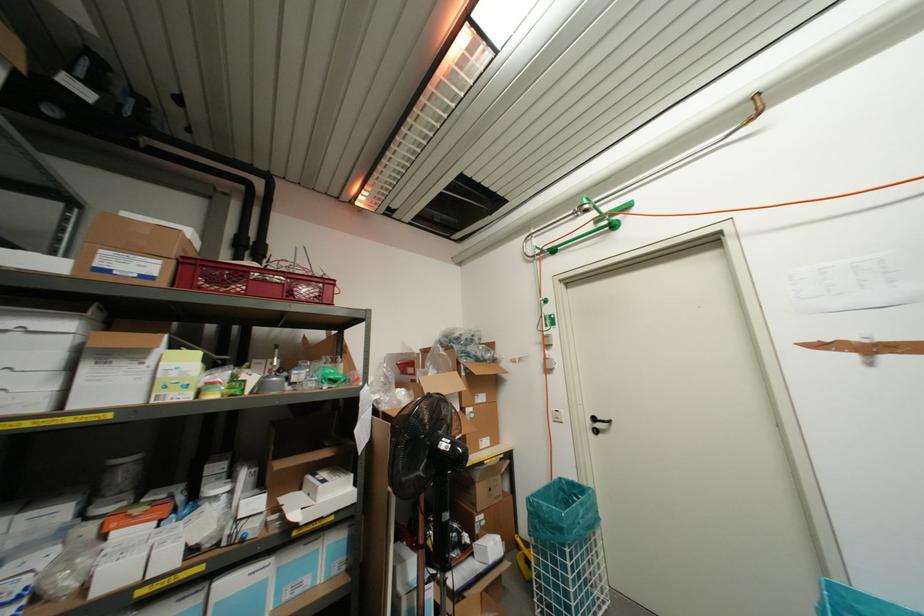
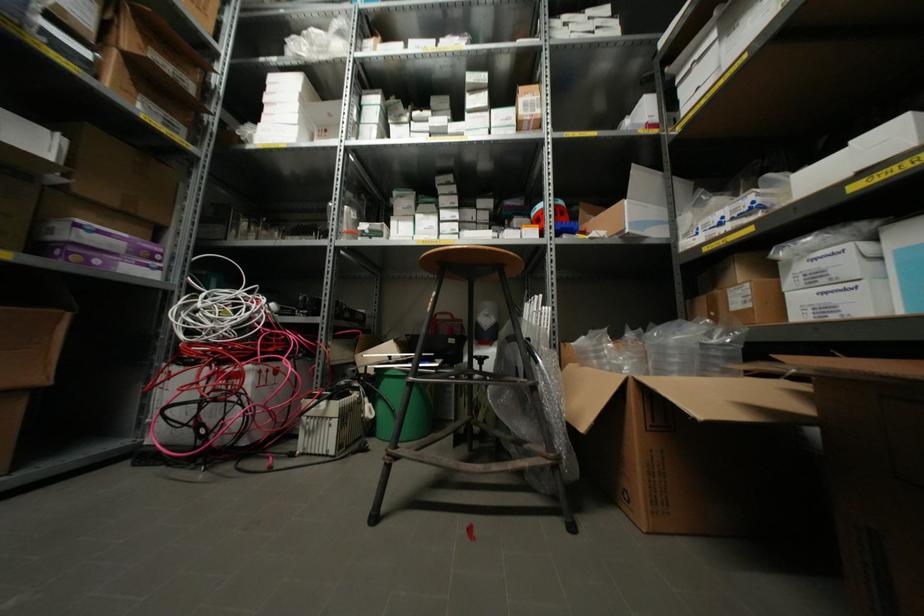
Find the pixel in the second image that matches point 108,416 in the first image.

(743, 55)